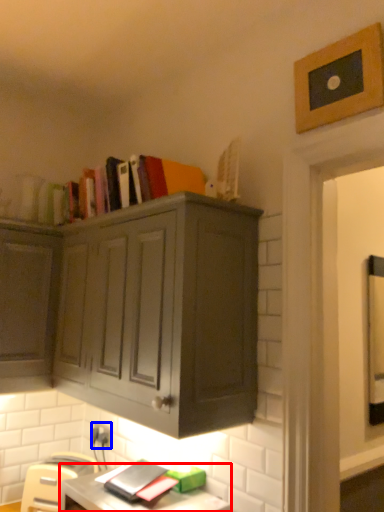
Question: Which object appears farthest to the camera in this image, computer desk (highlighted by a red box) or electric outlet (highlighted by a blue box)?

Choices:
 (A) computer desk
 (B) electric outlet

Answer: (B)